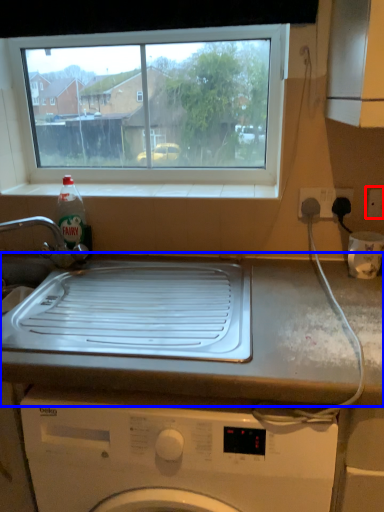
Question: Which object appears farthest to the camera in this image, electric outlet (highlighted by a red box) or countertop (highlighted by a blue box)?

Choices:
 (A) electric outlet
 (B) countertop

Answer: (A)